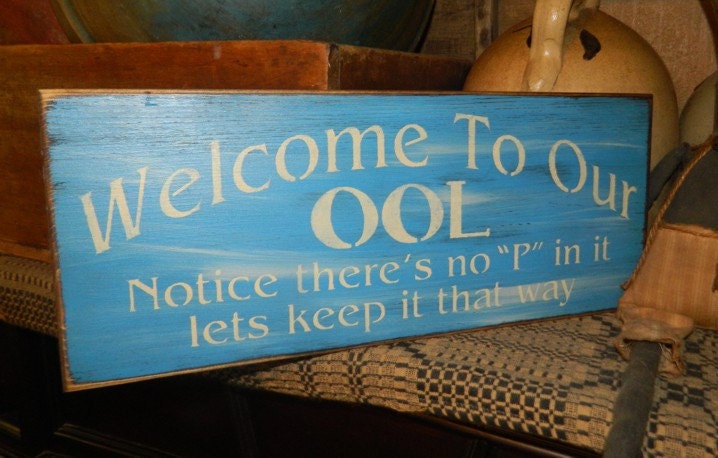
At what (x,y) coordinates should I click in order to perform the action: click on handles. Please return your answer as a coordinate pair (x, y). The height and width of the screenshot is (458, 718). Looking at the image, I should click on (549, 24).